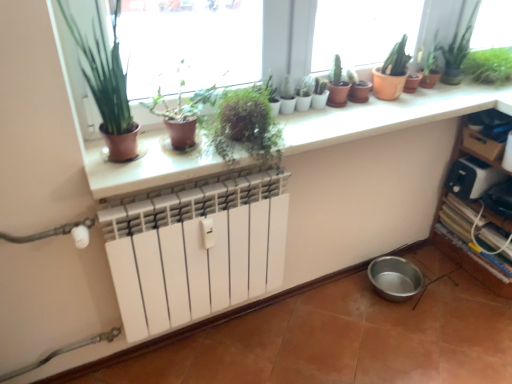
Locate an element on the screen. This screenshot has height=384, width=512. green matte plant at center, arranged as the 2th houseplant when viewed from the left is located at coordinates (182, 112).

At what (x,y) coordinates should I click in order to perform the action: click on green matte cactus at center, which is the fourth houseplant in left-to-right order. Please return your answer as a coordinate pair (x, y). Looking at the image, I should click on (x=339, y=84).

Identify the location of white plastic toaster at right. This screenshot has width=512, height=384. (471, 177).

Describe the element at coordinates (471, 177) in the screenshot. This screenshot has width=512, height=384. I see `white plastic toaster at right` at that location.

Measure the distance between point (497, 55) and camera.

The distance of point (497, 55) from camera is 6.21 feet.

In the scene shown: In order to face green leafy plant at upper right, which is the 1th houseplant in right-to-left order, should I rotate leftwards or rightwards?

Turn right by 30.030 degrees to look at green leafy plant at upper right, which is the 1th houseplant in right-to-left order.

Find the location of a particular element. green glossy plant at upper right is located at coordinates point(458,45).

How far apart are green matte plant at upper left and wooden shelf at lower right?

They are 35.22 inches apart.

At what (x,y) coordinates should I click in order to perform the action: click on bay window that is above the wooden shelf at lower right (from the image's perspective). Please return your answer as a coordinate pair (x, y). The image size is (512, 384). Looking at the image, I should click on (188, 44).

Who is shorter, green matte plant at upper left or wooden shelf at lower right?

green matte plant at upper left.

From a real-world perspective, does green matte plant at upper left stand above wooden shelf at lower right?

Yes, from a real-world perspective, green matte plant at upper left is above wooden shelf at lower right.

Is wooden shelf at lower right in front of or behind green matte plant at upper left in the image?

In the image, wooden shelf at lower right appears behind green matte plant at upper left.

Is wooden shelf at lower right positioned beyond the bounds of green matte plant at upper left?

Yes, wooden shelf at lower right is outside of green matte plant at upper left.

Where is `bay window above the wooden shelf at lower right (from a real-world perspective)`? This screenshot has height=384, width=512. bay window above the wooden shelf at lower right (from a real-world perspective) is located at coordinates (188, 44).

Which object is wider, wooden shelf at lower right or green matte plant at upper left?

With larger width is wooden shelf at lower right.

Is green matte cactus at upper right, acting as the fifth houseplant starting from the left, positioned behind wooden shelf at lower right?

Yes, the depth of green matte cactus at upper right, acting as the fifth houseplant starting from the left, is greater than that of wooden shelf at lower right.

Does green matte cactus at upper right, which appears as the 2th houseplant when viewed from the right, have a smaller size compared to wooden shelf at lower right?

Correct, green matte cactus at upper right, which appears as the 2th houseplant when viewed from the right, occupies less space than wooden shelf at lower right.

From the picture: Can you confirm if green matte cactus at upper right, which appears as the 2th houseplant when viewed from the right, is thinner than wooden shelf at lower right?

Indeed, green matte cactus at upper right, which appears as the 2th houseplant when viewed from the right, has a lesser width compared to wooden shelf at lower right.

From the image's perspective, is green matte cactus at upper right, acting as the fifth houseplant starting from the left, below wooden shelf at lower right?

No, from the image's perspective, green matte cactus at upper right, acting as the fifth houseplant starting from the left, is not beneath wooden shelf at lower right.

Could you tell me if green matte plant at upper center, marked as the 3th houseplant in a left-to-right arrangement, is turned towards green matte plant at upper left?

No, green matte plant at upper center, marked as the 3th houseplant in a left-to-right arrangement, is not oriented towards green matte plant at upper left.

Is green matte plant at upper center, marked as the 3th houseplant in a left-to-right arrangement, located outside green matte plant at upper left?

Yes.

Does green matte plant at upper center, marked as the 3th houseplant in a left-to-right arrangement, have a smaller size compared to green matte plant at upper left?

Yes, green matte plant at upper center, marked as the 3th houseplant in a left-to-right arrangement, is smaller than green matte plant at upper left.

Is point (238, 117) farther from viewer compared to point (195, 5)?

No, (238, 117) is in front of (195, 5).

In terms of size, does green matte plant at upper left appear bigger or smaller than white matte radiator at center?

green matte plant at upper left is smaller than white matte radiator at center.

Does point (321, 36) appear closer or farther from the camera than point (178, 324)?

Point (321, 36).

From the picture: Is green matte plant at upper left behind white matte radiator at center?

Yes, the depth of green matte plant at upper left is greater than that of white matte radiator at center.

Would you consider green matte cactus at center, which is the fourth houseplant in left-to-right order, to be distant from white matte radiator at center?

No, green matte cactus at center, which is the fourth houseplant in left-to-right order, is not far away from white matte radiator at center.

In the scene shown: Is green matte cactus at center, which is the fourth houseplant in left-to-right order, facing towards white matte radiator at center?

No, green matte cactus at center, which is the fourth houseplant in left-to-right order, does not turn towards white matte radiator at center.

This screenshot has width=512, height=384. Identify the location of the 3rd houseplant behind the white matte radiator at center, starting your count from the anchor. [339, 84].

Can you tell me how much green matte cactus at center, which is the fourth houseplant in left-to-right order, and white matte radiator at center differ in facing direction?

The angle between the facing direction of green matte cactus at center, which is the fourth houseplant in left-to-right order, and the facing direction of white matte radiator at center is 0.00052 degrees.

From the image's perspective, who appears lower, terracotta clay pots at upper center or green matte plant at center, acting as the fifth houseplant starting from the right?

terracotta clay pots at upper center.

Which of these two, terracotta clay pots at upper center or green matte plant at center, acting as the fifth houseplant starting from the right, stands taller?

green matte plant at center, acting as the fifth houseplant starting from the right, is taller.

Who is smaller, terracotta clay pots at upper center or green matte plant at center, acting as the fifth houseplant starting from the right?

terracotta clay pots at upper center is smaller.

Locate an element on the screen. bay window above the wooden shelf at lower right (from a real-world perspective) is located at coordinates (188, 44).

This screenshot has height=384, width=512. Find the location of `shelf directly beneath the green matte plant at upper left (from a real-world perspective)`. shelf directly beneath the green matte plant at upper left (from a real-world perspective) is located at coordinates (473, 222).

From the image, which object appears to be nearer to white matte radiator at center, green matte plant at upper center, arranged as the fourth houseplant when viewed from the right, or wooden shelf at lower right?

Based on the image, green matte plant at upper center, arranged as the fourth houseplant when viewed from the right, appears to be nearer to white matte radiator at center.

When comparing their distances from green matte plant at upper left, does green matte cactus at center, which is the fourth houseplant in left-to-right order, or white matte radiator at center seem closer?

green matte cactus at center, which is the fourth houseplant in left-to-right order.

Based on their spatial positions, is green matte cactus at center, which is the fourth houseplant in left-to-right order, or wooden shelf at lower right closer to green matte plant at upper center, arranged as the fourth houseplant when viewed from the right?

Based on the image, green matte cactus at center, which is the fourth houseplant in left-to-right order, appears to be nearer to green matte plant at upper center, arranged as the fourth houseplant when viewed from the right.

Looking at the image, which one is located further to green matte cactus at center, which is the fourth houseplant in left-to-right order, green matte plant at upper left, marked as the 1th houseplant in a left-to-right arrangement, or green matte plant at center, acting as the fifth houseplant starting from the right?

green matte plant at upper left, marked as the 1th houseplant in a left-to-right arrangement, is further to green matte cactus at center, which is the fourth houseplant in left-to-right order.

Looking at the image, which one is located closer to green matte cactus at center, which is the fourth houseplant in left-to-right order, green matte plant at center, arranged as the 2th houseplant when viewed from the left, or green matte plant at upper left, which ranks as the sixth houseplant in right-to-left order?

Based on the image, green matte plant at center, arranged as the 2th houseplant when viewed from the left, appears to be nearer to green matte cactus at center, which is the fourth houseplant in left-to-right order.

From the picture: When comparing their distances from green matte plant at upper left, does green matte plant at upper center, marked as the 3th houseplant in a left-to-right arrangement, or green matte plant at upper left, which ranks as the sixth houseplant in right-to-left order, seem closer?

green matte plant at upper center, marked as the 3th houseplant in a left-to-right arrangement.

From the picture: Based on their spatial positions, is green glossy plant at upper right or terracotta clay pots at upper center closer to green matte cactus at center, the third houseplant viewed from the right?

terracotta clay pots at upper center is positioned closer to the anchor green matte cactus at center, the third houseplant viewed from the right.

Estimate the real-world distances between objects in this image. Which object is further from terracotta clay pots at upper center, green matte plant at upper left, marked as the 1th houseplant in a left-to-right arrangement, or green leafy plant at upper right, positioned as the 6th houseplant in left-to-right order?

green leafy plant at upper right, positioned as the 6th houseplant in left-to-right order, is further to terracotta clay pots at upper center.

Identify the location of counter top between white matte radiator at center and green matte cactus at upper right, which appears as the 2th houseplant when viewed from the right, in the horizontal direction. (389, 114).

In order to click on counter top between white matte radiator at center and wooden shelf at lower right in this screenshot , I will do `click(389, 114)`.

Where is `counter top between green matte cactus at center, the third houseplant viewed from the right, and white matte radiator at center, in the vertical direction`? counter top between green matte cactus at center, the third houseplant viewed from the right, and white matte radiator at center, in the vertical direction is located at coordinates (389, 114).

At what (x,y) coordinates should I click in order to perform the action: click on bay window between green matte plant at upper center, marked as the 3th houseplant in a left-to-right arrangement, and wooden shelf at lower right, in the horizontal direction. Please return your answer as a coordinate pair (x, y). The image size is (512, 384). Looking at the image, I should click on (188, 44).